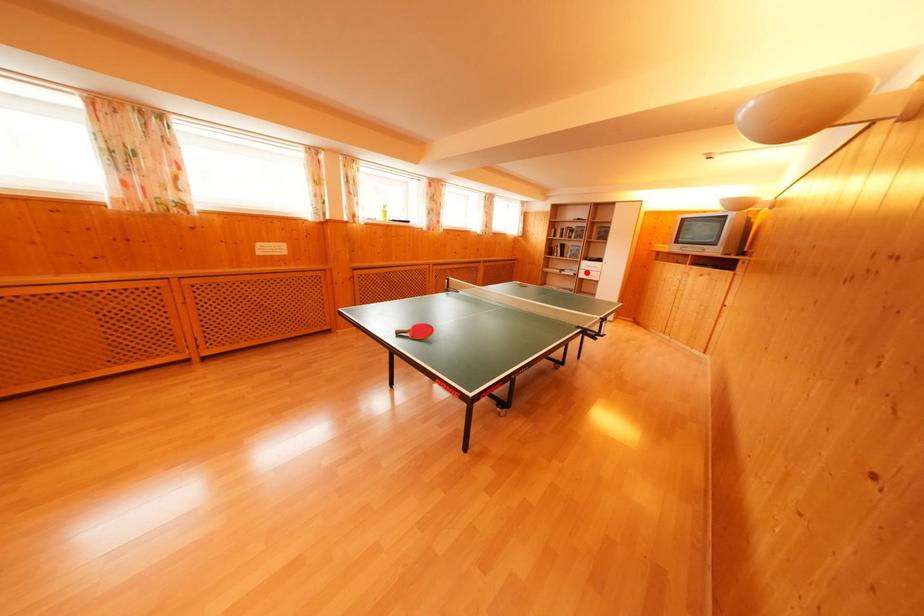
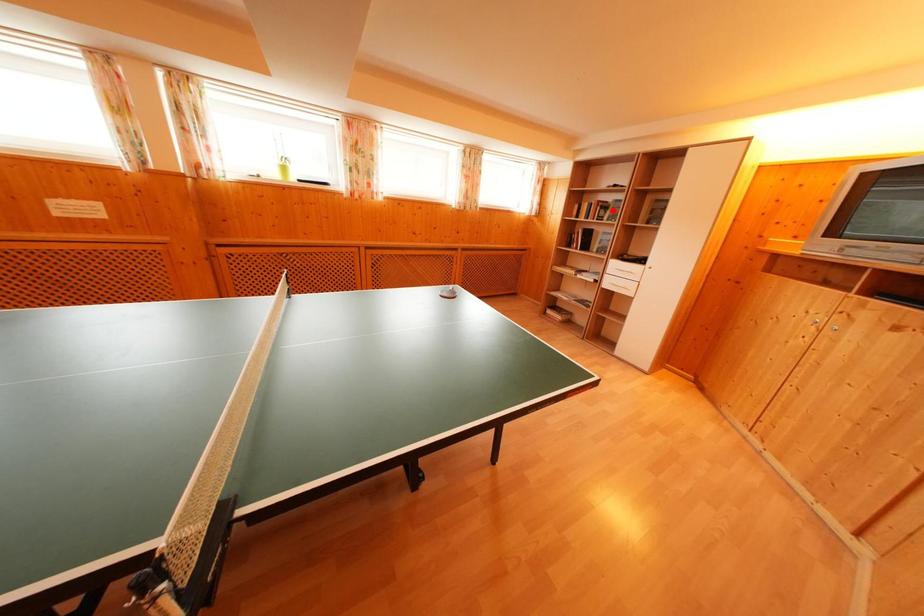
I am providing you with two images of the same scene from different viewpoints. A red point is marked on the first image and another point is marked on the second image. Does the point marked in image1 correspond to the same location as the one in image2?

No